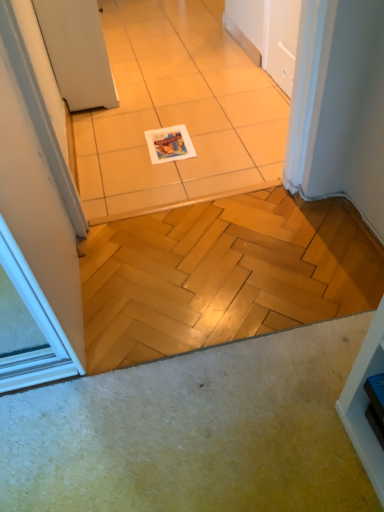
I want to click on vacant area on top of white glossy magazine at center (from a real-world perspective), so click(168, 139).